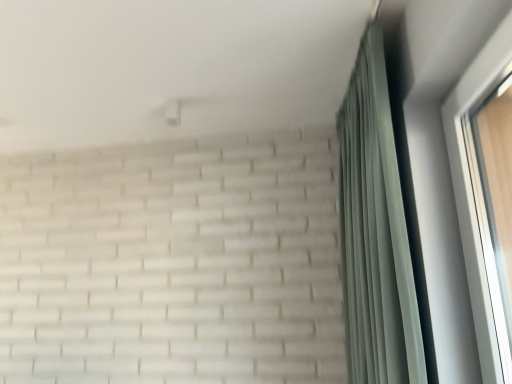
What do you see at coordinates (375, 232) in the screenshot? Image resolution: width=512 pixels, height=384 pixels. I see `green fabric curtain at right` at bounding box center [375, 232].

The width and height of the screenshot is (512, 384). I want to click on green fabric curtain at right, so click(x=375, y=232).

The image size is (512, 384). In order to click on green fabric curtain at right in this screenshot , I will do `click(375, 232)`.